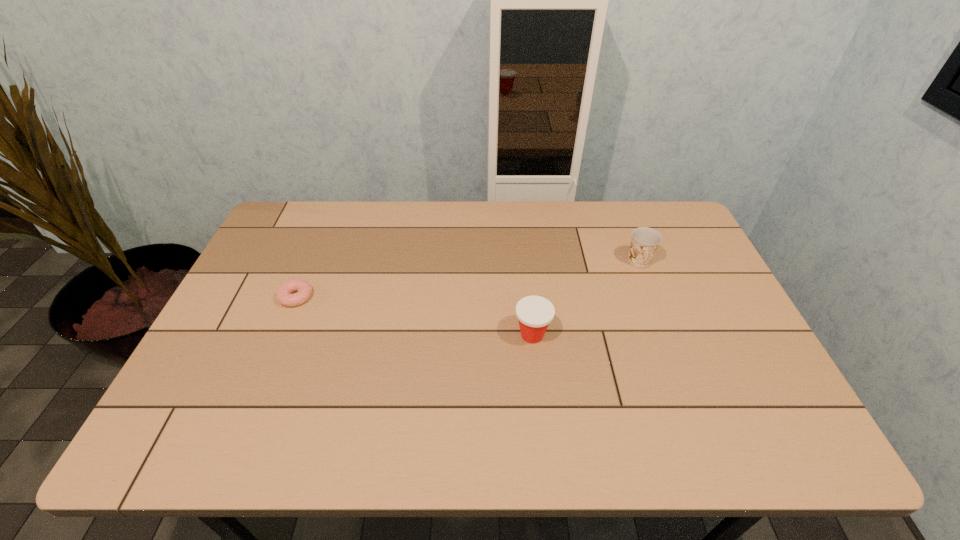
Where is `vacant point that satisfies the following two spatial constraints: 1. on the front side of the nearer Dixie cup; 2. on the left side of the leftmost object`? vacant point that satisfies the following two spatial constraints: 1. on the front side of the nearer Dixie cup; 2. on the left side of the leftmost object is located at coordinates (280, 335).

Find the location of a particular element. free space that satisfies the following two spatial constraints: 1. on the front side of the shortest object; 2. on the left side of the second object from right to left is located at coordinates click(280, 335).

Locate an element on the screen. The height and width of the screenshot is (540, 960). free space that satisfies the following two spatial constraints: 1. on the front side of the second object from right to left; 2. on the right side of the leftmost object is located at coordinates (280, 335).